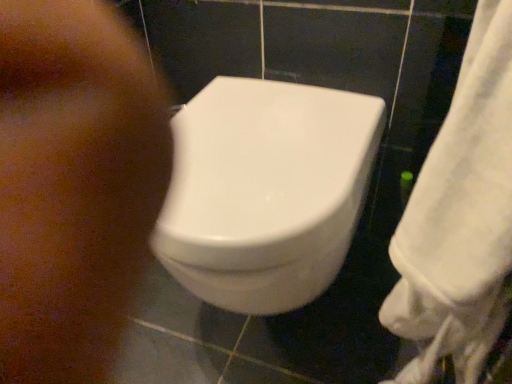
Question: Considering their positions, is brown matte skin at lower left located in front of or behind white fabric towel at right?

Choices:
 (A) behind
 (B) front

Answer: (A)

Question: From their relative heights in the image, would you say brown matte skin at lower left is taller or shorter than white fabric towel at right?

Choices:
 (A) short
 (B) tall

Answer: (A)

Question: Which of these objects is positioned farthest from the white fabric towel at right?

Choices:
 (A) white glossy toilet at center
 (B) brown matte skin at lower left

Answer: (B)

Question: Which of these objects is positioned farthest from the brown matte skin at lower left?

Choices:
 (A) white fabric towel at right
 (B) white glossy toilet at center

Answer: (A)